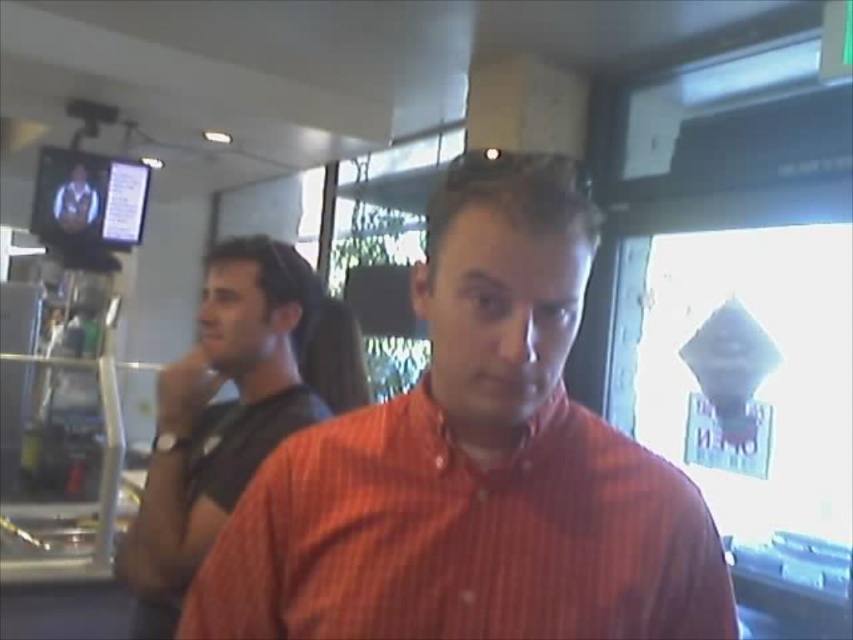
You are a photographer trying to capture a clear shot of the black matte shirt at left and the matte black shirt at upper left. Since both are wearing similar colors, which one would be easier to focus on due to their position?

The black matte shirt at left is in front of the matte black shirt at upper left, making it easier to focus on because it is closer to the camera.

You are a delivery person who needs to place a package between the black matte shirt at left and the matte black shirt at upper left. Can you fit the package that is 3 meters long between them?

The distance between the black matte shirt at left and the matte black shirt at upper left is 2.75 meters, so the package that is 3 meters long cannot fit between them.

You are a photographer trying to capture a candid shot of both the orange striped shirt at center and the matte black shirt at upper left. Based on their positions, which subject is closer to the camera?

The orange striped shirt at center is closer to the camera because it is positioned under the matte black shirt at upper left, indicating it is in the foreground.